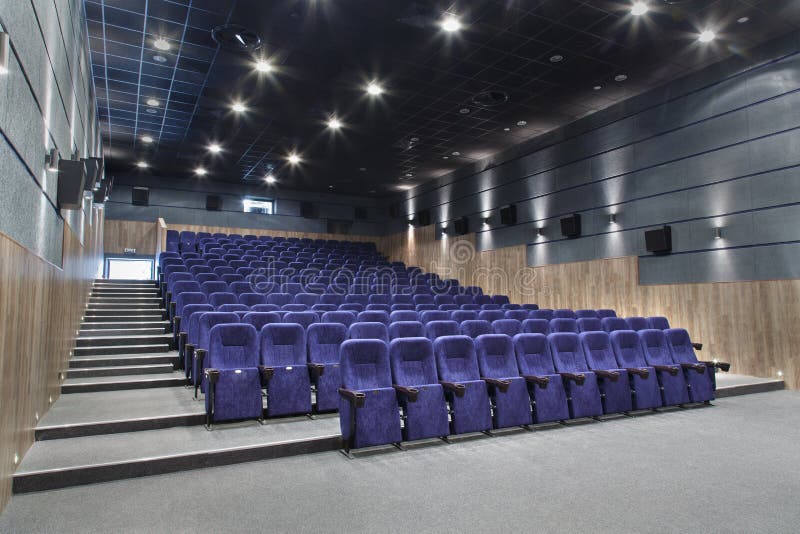
At what (x,y) coordinates should I click in order to perform the action: click on blue wall panels. Please return your answer as a coordinate pair (x, y). The height and width of the screenshot is (534, 800). Looking at the image, I should click on (738, 93), (721, 125), (720, 161), (720, 190), (726, 222), (724, 264).